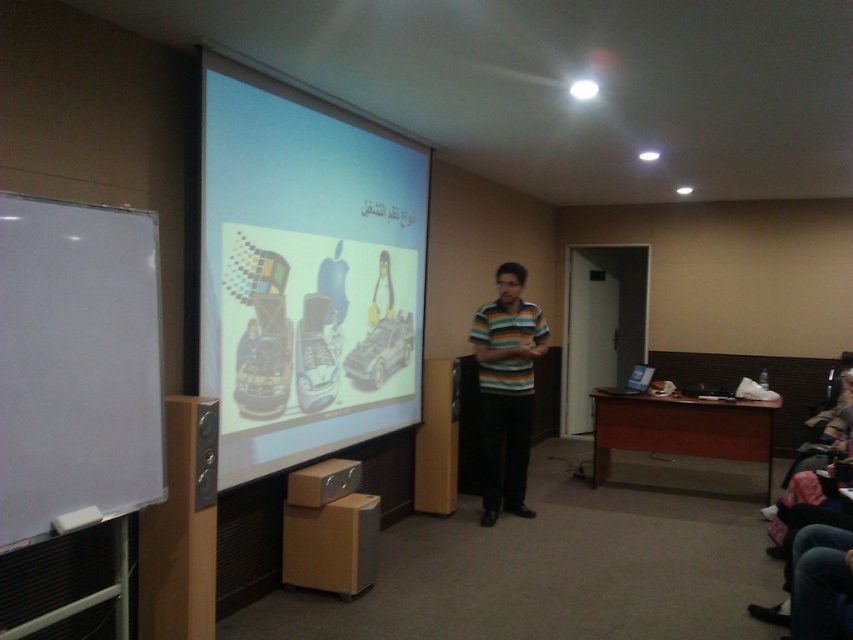
Question: Does white matte projection screen at center have a lesser width compared to striped cotton shirt at center?

Choices:
 (A) yes
 (B) no

Answer: (B)

Question: Is white matte projection screen at center wider than striped cotton shirt at center?

Choices:
 (A) no
 (B) yes

Answer: (B)

Question: Can you confirm if white matte projection screen at center is positioned to the left of striped cotton shirt at center?

Choices:
 (A) yes
 (B) no

Answer: (A)